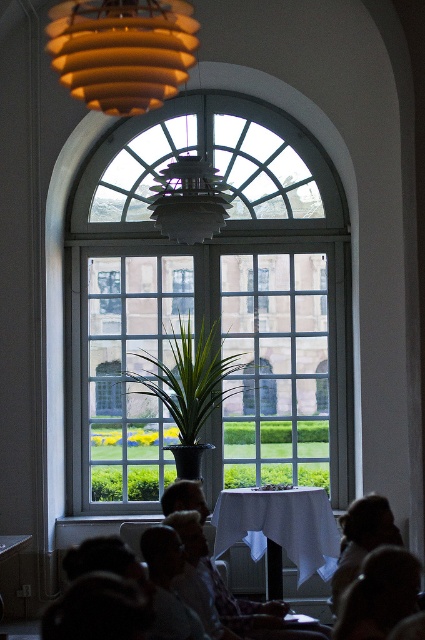
Is clear glass window at center taller than white cloth-covered table at center?

In fact, clear glass window at center may be shorter than white cloth-covered table at center.

Identify the location of clear glass window at center. The image size is (425, 640). (209, 305).

Where is `clear glass window at center`? The image size is (425, 640). clear glass window at center is located at coordinates (209, 305).

Does clear glass window at center appear over dark hair at lower right?

Yes.

Between point (133, 344) and point (380, 516), which one is positioned behind?

Point (133, 344)

The height and width of the screenshot is (640, 425). I want to click on clear glass window at center, so click(209, 305).

Find the location of a particular element. clear glass window at center is located at coordinates (209, 305).

Between clear glass window at center and silky brown hair at lower right, which one has less height?

With less height is silky brown hair at lower right.

Which is in front, point (249, 115) or point (373, 576)?

Positioned in front is point (373, 576).

Does point (283, 252) come farther from viewer compared to point (380, 593)?

Yes.

The height and width of the screenshot is (640, 425). I want to click on clear glass window at center, so click(209, 305).